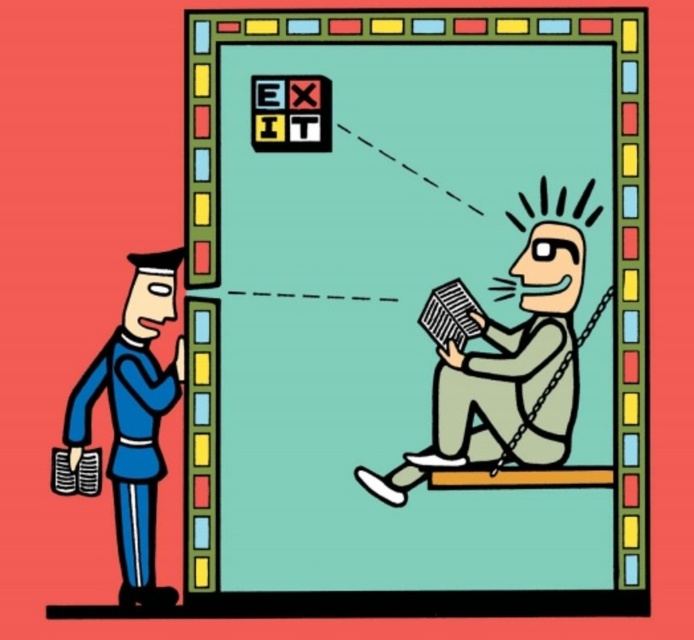
You are standing in the scene and want to place a new object between the matte gray book at center and the blue fabric uniform at left. Is there enough space to do so?

The matte gray book at center is to the right of the blue fabric uniform at left, so there is space between them to place a new object.

Based on the coordinates provided in the scene description, what is the exact 2D location of the matte gray book at center?

The matte gray book at center is located at the 2D coordinates of point (416, 310).